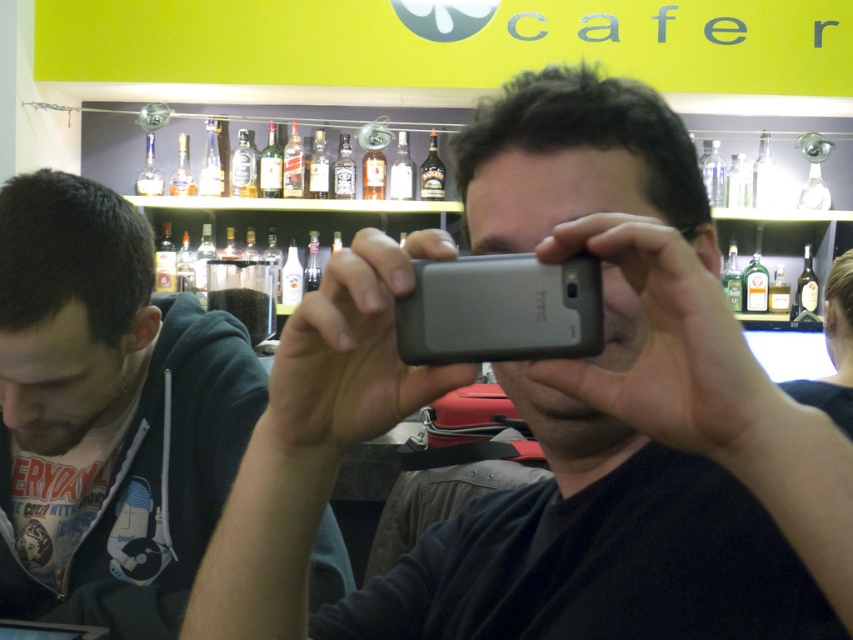
You are at the cafe and want to place a new menu board. The menu board must be placed between the two points given by the coordinates point (68, 554) and point (535, 268). Can you determine which point is closer to the entrance of the cafe?

Point (535, 268) is closer to the entrance because it is in front of point (68, 554), which is behind it.

You are a customer in the cafe and want to place your gray matte phone at center on the table where the dark blue hoodie at left is currently resting. Is there enough space for both items?

The gray matte phone at center occupies less space than the dark blue hoodie at left, so there should be enough space for both items on the table.

From the picture: You are a customer at the cafe and you want to place both the gray matte phone at center and the gray matte htc phone at center on the table without overlapping. Which phone should you place first to ensure they both fit?

The gray matte htc phone at center should be placed first since the gray matte phone at center might be wider, so placing the wider one first ensures there is enough space for both.